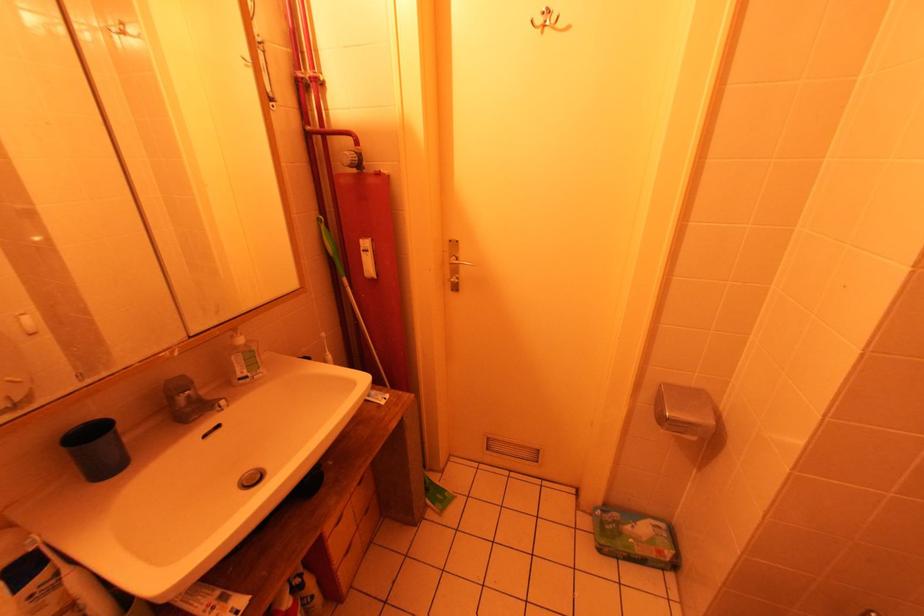
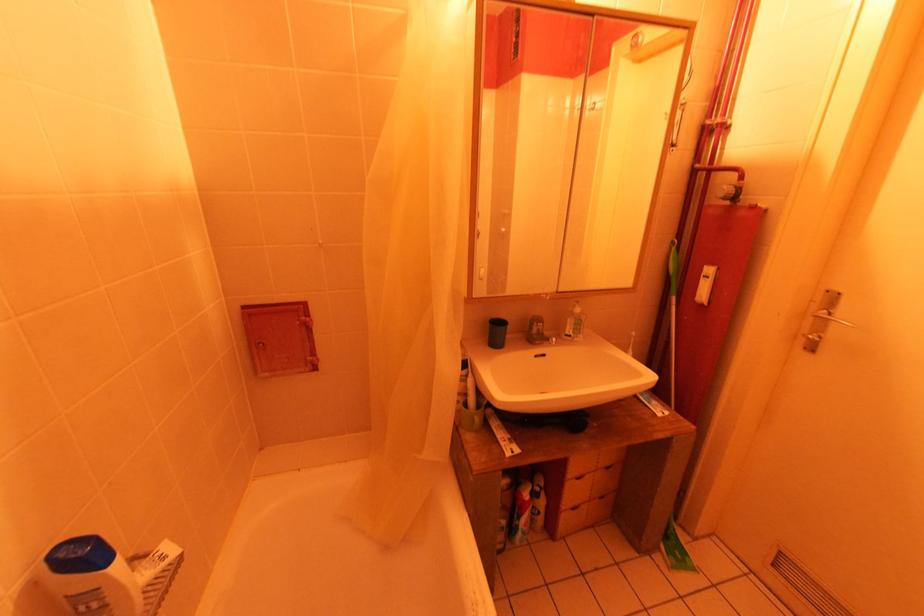
Question: The images are taken continuously from a first-person perspective. In which direction is your viewpoint rotating?

Choices:
 (A) Left
 (B) Right
 (C) Up
 (D) Down

Answer: (A)